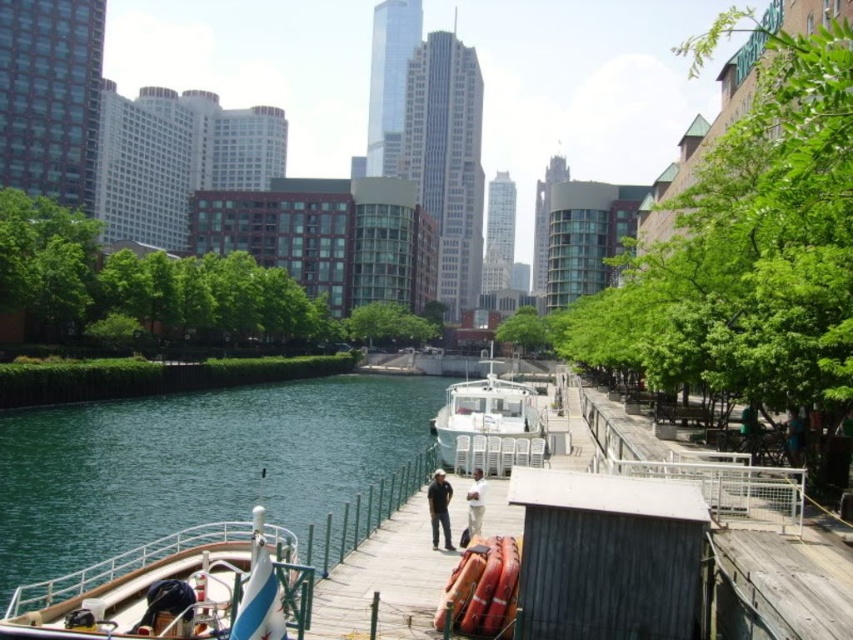
Question: Where is green water at center located in relation to light beige fabric at center in the image?

Choices:
 (A) right
 (B) left

Answer: (B)

Question: Which point appears closest to the camera in this image?

Choices:
 (A) (276, 400)
 (B) (500, 412)
 (C) (442, 515)

Answer: (C)

Question: Does green water at center have a larger size compared to wooden polished boat at lower left?

Choices:
 (A) no
 (B) yes

Answer: (B)

Question: Can you confirm if wooden polished boat at lower left is positioned above dark blue jeans at center?

Choices:
 (A) yes
 (B) no

Answer: (B)

Question: Among these points, which one is nearest to the camera?

Choices:
 (A) tap(517, 429)
 (B) tap(433, 522)
 (C) tap(270, 456)
 (D) tap(200, 547)

Answer: (D)

Question: Based on their relative distances, which object is nearer to the white plastic boat at center?

Choices:
 (A) light beige fabric at center
 (B) green water at center
 (C) wooden polished boat at lower left

Answer: (B)